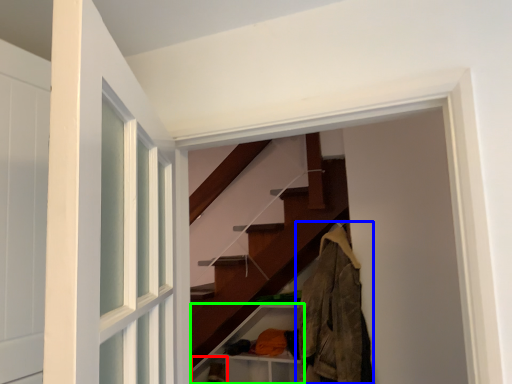
Question: Based on their relative distances, which object is farther from shelf (highlighted by a red box)? Choose from clothing (highlighted by a blue box) and cabinet (highlighted by a green box).

Choices:
 (A) clothing
 (B) cabinet

Answer: (A)